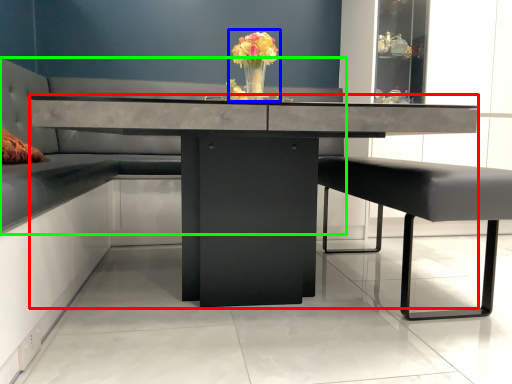
Question: Which object is positioned closest to table (highlighted by a red box)? Select from floral arrangement (highlighted by a blue box) and couch (highlighted by a green box).

Choices:
 (A) floral arrangement
 (B) couch

Answer: (A)